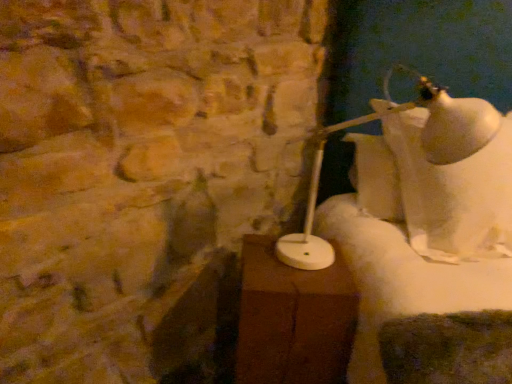
This screenshot has width=512, height=384. What do you see at coordinates (293, 319) in the screenshot? I see `brown wood table at center` at bounding box center [293, 319].

You are a GUI agent. You are given a task and a screenshot of the screen. Output one action in this format:
    pyautogui.click(x=<x>, y=<y>)
    Task: Click on the brown wood table at center
    The image size is (512, 384).
    Given the screenshot: What is the action you would take?
    pyautogui.click(x=293, y=319)

Where is `white glossy lamp at right`? The image size is (512, 384). white glossy lamp at right is located at coordinates (401, 151).

Describe the element at coordinates (401, 151) in the screenshot. I see `white glossy lamp at right` at that location.

Identify the location of brown wood table at center. This screenshot has height=384, width=512. [293, 319].

Is white glossy lamp at right to the left of brown wood table at center from the viewer's perspective?

In fact, white glossy lamp at right is to the right of brown wood table at center.

Is the position of white glossy lamp at right less distant than that of brown wood table at center?

No, the depth of white glossy lamp at right is greater than that of brown wood table at center.

Which is in front, point (298, 260) or point (333, 359)?

The point (333, 359) is closer to the camera.

From the image's perspective, does white glossy lamp at right appear higher than brown wood table at center?

Indeed, from the image's perspective, white glossy lamp at right is shown above brown wood table at center.

From a real-world perspective, is white glossy lamp at right physically below brown wood table at center?

Actually, white glossy lamp at right is physically above brown wood table at center in the real world.

Which of these two, white glossy lamp at right or brown wood table at center, is wider?

white glossy lamp at right.

Is white glossy lamp at right taller or shorter than brown wood table at center?

Considering their sizes, white glossy lamp at right has more height than brown wood table at center.

Based on their sizes in the image, would you say white glossy lamp at right is bigger or smaller than brown wood table at center?

white glossy lamp at right is bigger than brown wood table at center.

Can we say white glossy lamp at right lies outside brown wood table at center?

Absolutely, white glossy lamp at right is external to brown wood table at center.

Is white glossy lamp at right positioned far away from brown wood table at center?

No, white glossy lamp at right is not far away from brown wood table at center.

Could you tell me if white glossy lamp at right is facing brown wood table at center?

No, white glossy lamp at right is not facing towards brown wood table at center.

How different are the orientations of white glossy lamp at right and brown wood table at center in degrees?

The angular difference between white glossy lamp at right and brown wood table at center is 4.91 degrees.

Where is `table below the white glossy lamp at right (from the image's perspective)`? The image size is (512, 384). table below the white glossy lamp at right (from the image's perspective) is located at coordinates (293, 319).

Does brown wood table at center appear on the left side of white glossy lamp at right?

Yes, brown wood table at center is to the left of white glossy lamp at right.

Is brown wood table at center positioned in front of white glossy lamp at right?

Yes, brown wood table at center is in front of white glossy lamp at right.

Is point (263, 343) farther from viewer compared to point (311, 179)?

No, it is in front of (311, 179).

From the image's perspective, between brown wood table at center and white glossy lamp at right, which one is located above?

white glossy lamp at right appears higher in the image.

From the picture: From a real-world perspective, who is located higher, brown wood table at center or white glossy lamp at right?

white glossy lamp at right.

In terms of width, does brown wood table at center look wider or thinner when compared to white glossy lamp at right?

Clearly, brown wood table at center has less width compared to white glossy lamp at right.

Considering the sizes of brown wood table at center and white glossy lamp at right in the image, is brown wood table at center taller or shorter than white glossy lamp at right?

Clearly, brown wood table at center is shorter compared to white glossy lamp at right.

In the scene shown: Can you confirm if brown wood table at center is bigger than white glossy lamp at right?

No.

Do you think brown wood table at center is within white glossy lamp at right, or outside of it?

brown wood table at center is located beyond the bounds of white glossy lamp at right.

Is brown wood table at center far away from white glossy lamp at right?

They are positioned close to each other.

In the scene shown: Is brown wood table at center facing towards white glossy lamp at right?

No.

How far apart are brown wood table at center and white glossy lamp at right?

9.53 inches.

Locate an element on the screen. The image size is (512, 384). table that appears in front of the white glossy lamp at right is located at coordinates (293, 319).

The height and width of the screenshot is (384, 512). I want to click on lamp that appears behind the brown wood table at center, so click(x=401, y=151).

At what (x,y) coordinates should I click in order to perform the action: click on table in front of the white glossy lamp at right. Please return your answer as a coordinate pair (x, y). The image size is (512, 384). Looking at the image, I should click on (293, 319).